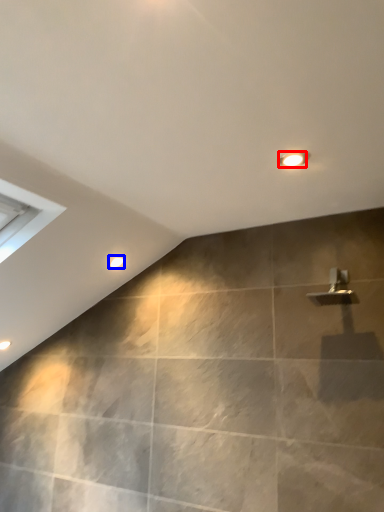
Question: Which of the following is the closest to the observer, light fixture (highlighted by a red box) or droplight (highlighted by a blue box)?

Choices:
 (A) light fixture
 (B) droplight

Answer: (A)